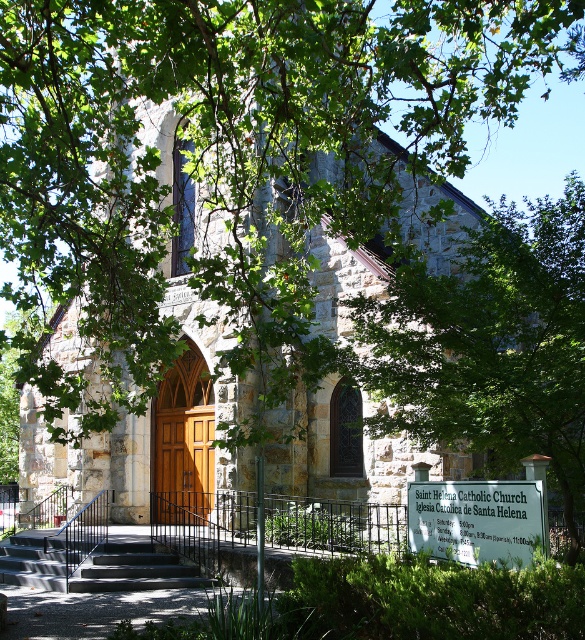
Question: Is green leafy tree at lower right wider than dark gray concrete stairs at center?

Choices:
 (A) no
 (B) yes

Answer: (B)

Question: Which point is farther to the camera?

Choices:
 (A) (288, 305)
 (B) (577, 248)
 (C) (140, 570)

Answer: (C)

Question: Observing the image, what is the correct spatial positioning of green leafy tree at lower right in reference to dark gray concrete stairs at center?

Choices:
 (A) below
 (B) above

Answer: (B)

Question: Which object is farther from the camera taking this photo?

Choices:
 (A) dark gray concrete stairs at center
 (B) green leafy tree at lower right

Answer: (A)

Question: Which object is farther from the camera taking this photo?

Choices:
 (A) green leafy tree at lower right
 (B) stone church at center

Answer: (A)

Question: Does stone church at center appear on the right side of green leafy tree at lower right?

Choices:
 (A) yes
 (B) no

Answer: (B)